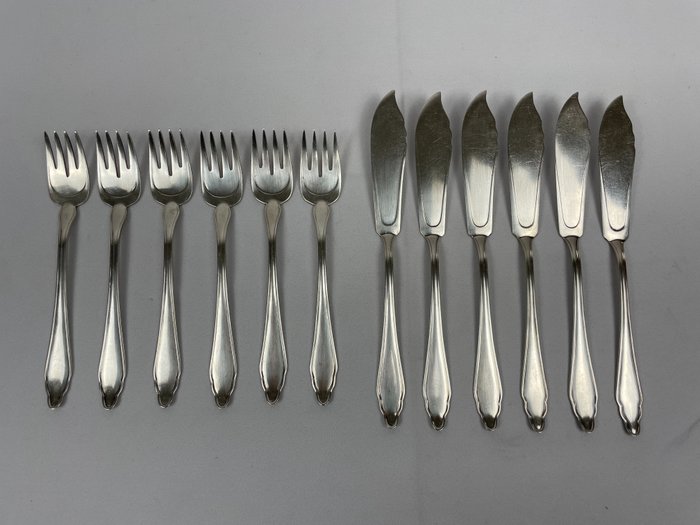
This screenshot has width=700, height=525. I want to click on knife handles, so click(626, 406), click(572, 393), click(530, 401), click(500, 393), click(426, 387), click(388, 387).